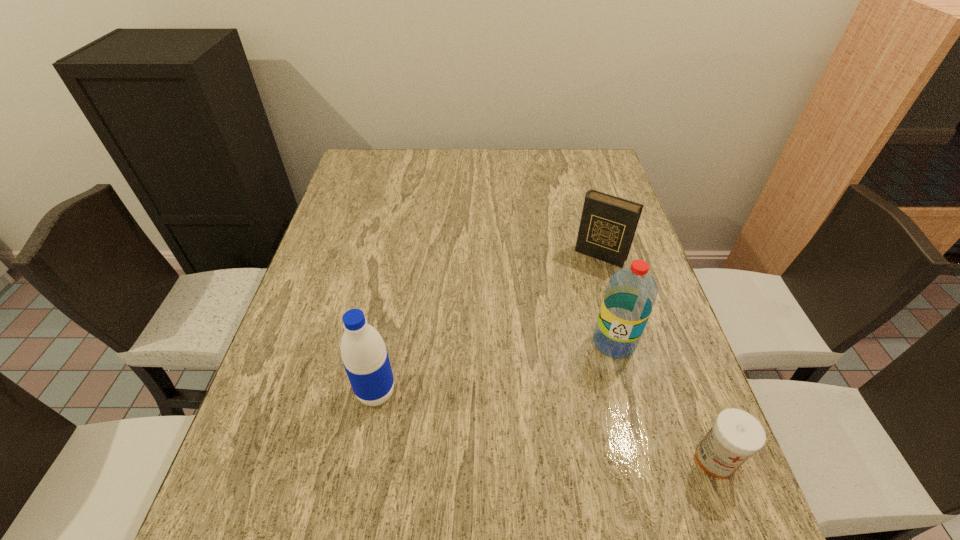
You are a GUI agent. You are given a task and a screenshot of the screen. Output one action in this format:
    pyautogui.click(x=<x>, y=<y>)
    Task: Click on the nearer water bottle
    
    Given the screenshot: What is the action you would take?
    pyautogui.click(x=365, y=358)

Find the location of a particular element. The height and width of the screenshot is (540, 960). the leftmost object is located at coordinates (365, 358).

Where is `the shortest object`? the shortest object is located at coordinates (736, 435).

Locate an element on the screen. The height and width of the screenshot is (540, 960). medicine is located at coordinates (736, 435).

What are the coordinates of `the farther water bottle` in the screenshot? It's located at click(x=631, y=292).

Locate an element on the screen. The image size is (960, 540). the right water bottle is located at coordinates (631, 292).

Where is `the farthest object`? the farthest object is located at coordinates (608, 223).

Locate an element on the screen. the third tallest object is located at coordinates (608, 223).

You are a GUI agent. You are given a task and a screenshot of the screen. Output one action in this format:
    pyautogui.click(x=<x>, y=<y>)
    Task: Click on the vacant space located 0.220m on the right of the nearer water bottle
    Image resolution: width=960 pixels, height=540 pixels.
    Given the screenshot: What is the action you would take?
    pyautogui.click(x=503, y=393)

At what (x,y) coordinates should I click in order to perform the action: click on blank space located 0.330m on the back of the nearest object. Please return your answer as a coordinate pair (x, y). Looking at the image, I should click on (658, 308).